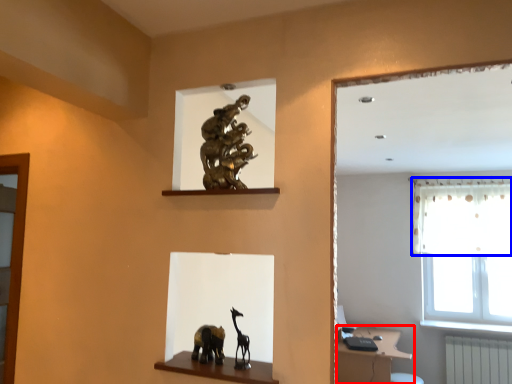
Question: Which object appears farthest to the camera in this image, vanity (highlighted by a red box) or curtain (highlighted by a blue box)?

Choices:
 (A) vanity
 (B) curtain

Answer: (B)